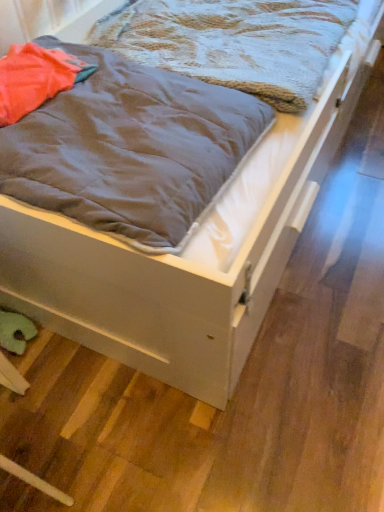
What do you see at coordinates (234, 42) in the screenshot?
I see `textured gray blanket at upper left, the 1th blanket positioned from the back` at bounding box center [234, 42].

Where is `textured gray blanket at upper left, the 2th blanket from the front`? This screenshot has height=512, width=384. textured gray blanket at upper left, the 2th blanket from the front is located at coordinates (234, 42).

This screenshot has width=384, height=512. What are the coordinates of `gray matte blanket at center, positioned as the first blanket in front-to-back order` in the screenshot? It's located at (130, 148).

Describe the element at coordinates (130, 148) in the screenshot. This screenshot has width=384, height=512. I see `gray matte blanket at center, the second blanket when ordered from back to front` at that location.

The height and width of the screenshot is (512, 384). I want to click on textured gray blanket at upper left, the 1th blanket positioned from the back, so click(234, 42).

Is textured gray blanket at upper left, the 1th blanket positioned from the back, at the right side of gray matte blanket at center, positioned as the first blanket in front-to-back order?

Yes.

Does textured gray blanket at upper left, the 2th blanket from the front, come in front of gray matte blanket at center, the second blanket when ordered from back to front?

That is False.

Which point is more forward, (216, 51) or (131, 134)?

Point (131, 134)

From the image's perspective, who appears lower, textured gray blanket at upper left, the 2th blanket from the front, or gray matte blanket at center, positioned as the first blanket in front-to-back order?

From the image's view, gray matte blanket at center, positioned as the first blanket in front-to-back order, is below.

From a real-world perspective, is textured gray blanket at upper left, the 1th blanket positioned from the back, under gray matte blanket at center, positioned as the first blanket in front-to-back order?

Yes, from a real-world perspective, textured gray blanket at upper left, the 1th blanket positioned from the back, is under gray matte blanket at center, positioned as the first blanket in front-to-back order.

Is textured gray blanket at upper left, the 2th blanket from the front, wider than gray matte blanket at center, the second blanket when ordered from back to front?

Correct, the width of textured gray blanket at upper left, the 2th blanket from the front, exceeds that of gray matte blanket at center, the second blanket when ordered from back to front.

Considering the sizes of textured gray blanket at upper left, the 1th blanket positioned from the back, and gray matte blanket at center, positioned as the first blanket in front-to-back order, in the image, is textured gray blanket at upper left, the 1th blanket positioned from the back, taller or shorter than gray matte blanket at center, positioned as the first blanket in front-to-back order,?

textured gray blanket at upper left, the 1th blanket positioned from the back, is shorter than gray matte blanket at center, positioned as the first blanket in front-to-back order.

Is textured gray blanket at upper left, the 2th blanket from the front, smaller than gray matte blanket at center, positioned as the first blanket in front-to-back order?

No.

Is gray matte blanket at center, the second blanket when ordered from back to front, a part of textured gray blanket at upper left, the 1th blanket positioned from the back?

No, gray matte blanket at center, the second blanket when ordered from back to front, is not inside textured gray blanket at upper left, the 1th blanket positioned from the back.

Is textured gray blanket at upper left, the 1th blanket positioned from the back, touching gray matte blanket at center, positioned as the first blanket in front-to-back order?

No, textured gray blanket at upper left, the 1th blanket positioned from the back, is not with gray matte blanket at center, positioned as the first blanket in front-to-back order.

Does textured gray blanket at upper left, the 2th blanket from the front, turn towards gray matte blanket at center, positioned as the first blanket in front-to-back order?

No, textured gray blanket at upper left, the 2th blanket from the front, is not turned towards gray matte blanket at center, positioned as the first blanket in front-to-back order.

How far apart are textured gray blanket at upper left, the 2th blanket from the front, and gray matte blanket at center, the second blanket when ordered from back to front?

textured gray blanket at upper left, the 2th blanket from the front, is 14.42 inches from gray matte blanket at center, the second blanket when ordered from back to front.

Find the location of a particular element. The height and width of the screenshot is (512, 384). blanket that appears below the gray matte blanket at center, positioned as the first blanket in front-to-back order (from a real-world perspective) is located at coordinates (234, 42).

In the scene shown: Considering the relative positions of gray matte blanket at center, the second blanket when ordered from back to front, and textured gray blanket at upper left, the 1th blanket positioned from the back, in the image provided, is gray matte blanket at center, the second blanket when ordered from back to front, to the left of textured gray blanket at upper left, the 1th blanket positioned from the back, from the viewer's perspective?

Yes, gray matte blanket at center, the second blanket when ordered from back to front, is to the left of textured gray blanket at upper left, the 1th blanket positioned from the back.

Is the depth of gray matte blanket at center, the second blanket when ordered from back to front, less than that of textured gray blanket at upper left, the 1th blanket positioned from the back?

Yes, the depth of gray matte blanket at center, the second blanket when ordered from back to front, is less than that of textured gray blanket at upper left, the 1th blanket positioned from the back.

Which is less distant, [197,82] or [323,69]?

The point [197,82] is in front.

From the image's perspective, does gray matte blanket at center, the second blanket when ordered from back to front, appear lower than textured gray blanket at upper left, the 1th blanket positioned from the back?

Yes.

From a real-world perspective, who is located higher, gray matte blanket at center, positioned as the first blanket in front-to-back order, or textured gray blanket at upper left, the 1th blanket positioned from the back?

gray matte blanket at center, positioned as the first blanket in front-to-back order, from a real-world perspective.

Does gray matte blanket at center, positioned as the first blanket in front-to-back order, have a lesser width compared to textured gray blanket at upper left, the 2th blanket from the front?

Yes, gray matte blanket at center, positioned as the first blanket in front-to-back order, is thinner than textured gray blanket at upper left, the 2th blanket from the front.

In terms of height, does gray matte blanket at center, positioned as the first blanket in front-to-back order, look taller or shorter compared to textured gray blanket at upper left, the 2th blanket from the front?

Clearly, gray matte blanket at center, positioned as the first blanket in front-to-back order, is taller compared to textured gray blanket at upper left, the 2th blanket from the front.

Is gray matte blanket at center, positioned as the first blanket in front-to-back order, bigger than textured gray blanket at upper left, the 1th blanket positioned from the back?

Actually, gray matte blanket at center, positioned as the first blanket in front-to-back order, might be smaller than textured gray blanket at upper left, the 1th blanket positioned from the back.

Is gray matte blanket at center, positioned as the first blanket in front-to-back order, not inside textured gray blanket at upper left, the 2th blanket from the front?

Yes, gray matte blanket at center, positioned as the first blanket in front-to-back order, is not within textured gray blanket at upper left, the 2th blanket from the front.

Is gray matte blanket at center, the second blanket when ordered from back to front, next to textured gray blanket at upper left, the 1th blanket positioned from the back?

gray matte blanket at center, the second blanket when ordered from back to front, and textured gray blanket at upper left, the 1th blanket positioned from the back, are clearly separated.

Could you tell me if gray matte blanket at center, positioned as the first blanket in front-to-back order, is facing textured gray blanket at upper left, the 1th blanket positioned from the back?

No.

Consider the image. What's the angular difference between gray matte blanket at center, the second blanket when ordered from back to front, and textured gray blanket at upper left, the 1th blanket positioned from the back,'s facing directions?

They differ by 0.000244 degrees in their facing directions.

Measure the distance from gray matte blanket at center, positioned as the first blanket in front-to-back order, to textured gray blanket at upper left, the 2th blanket from the front.

gray matte blanket at center, positioned as the first blanket in front-to-back order, and textured gray blanket at upper left, the 2th blanket from the front, are 14.42 inches apart.

Find the location of `blanket behind the gray matte blanket at center, positioned as the first blanket in front-to-back order`. blanket behind the gray matte blanket at center, positioned as the first blanket in front-to-back order is located at coordinates (234, 42).

Identify the location of blanket that appears on the right of gray matte blanket at center, the second blanket when ordered from back to front. (234, 42).

Where is `blanket above the textured gray blanket at upper left, the 2th blanket from the front (from a real-world perspective)`? This screenshot has height=512, width=384. blanket above the textured gray blanket at upper left, the 2th blanket from the front (from a real-world perspective) is located at coordinates (130, 148).